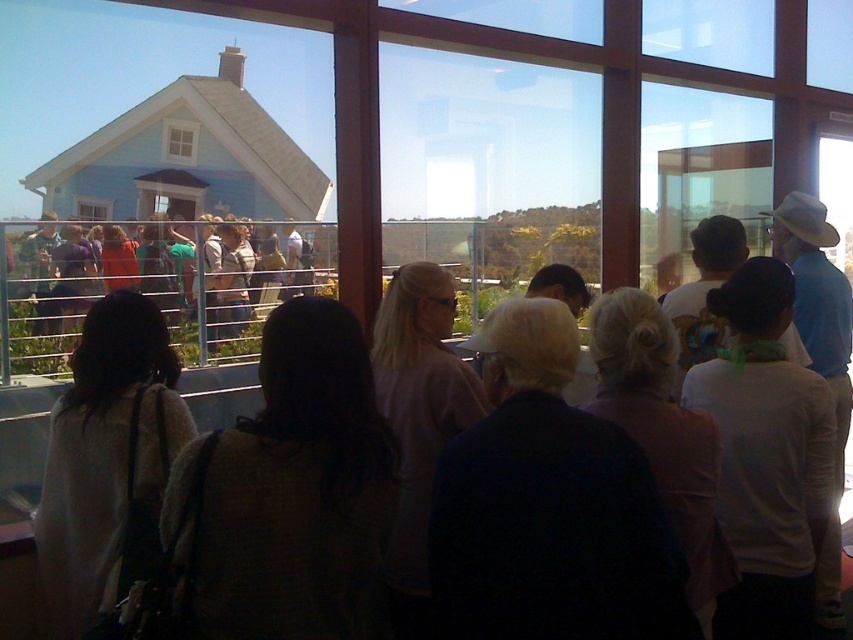
Question: Is light brown sweater at center smaller than white wooden window at upper center?

Choices:
 (A) no
 (B) yes

Answer: (A)

Question: Is light brown sweater at center to the left of white wooden window at upper center from the viewer's perspective?

Choices:
 (A) no
 (B) yes

Answer: (A)

Question: Based on their relative distances, which object is nearer to the transparent glass window at upper left?

Choices:
 (A) white wooden window at upper center
 (B) light brown sweater at center

Answer: (A)

Question: Estimate the real-world distances between objects in this image. Which object is closer to the light beige sweater at left?

Choices:
 (A) transparent glass window at upper left
 (B) light brown sweater at center
 (C) white wooden window at upper center

Answer: (B)

Question: Which object is closer to the camera taking this photo?

Choices:
 (A) transparent glass window at upper left
 (B) white wooden window at upper center
 (C) light brown sweater at center
 (D) light beige sweater at left

Answer: (D)

Question: Is light beige sweater at left behind light brown sweater at center?

Choices:
 (A) no
 (B) yes

Answer: (A)